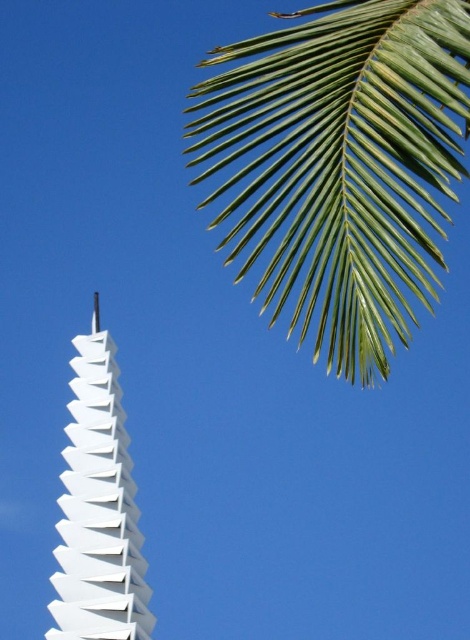
Question: Which of the following is the farthest from the observer?

Choices:
 (A) green leafy palm at upper right
 (B) white matte pyramid at center

Answer: (B)

Question: Is green leafy palm at upper right positioned in front of white matte pyramid at center?

Choices:
 (A) no
 (B) yes

Answer: (B)

Question: Is the position of green leafy palm at upper right less distant than that of white matte pyramid at center?

Choices:
 (A) no
 (B) yes

Answer: (B)

Question: Which object appears farthest from the camera in this image?

Choices:
 (A) white matte pyramid at center
 (B) green leafy palm at upper right

Answer: (A)

Question: Can you confirm if green leafy palm at upper right is thinner than white matte pyramid at center?

Choices:
 (A) no
 (B) yes

Answer: (A)